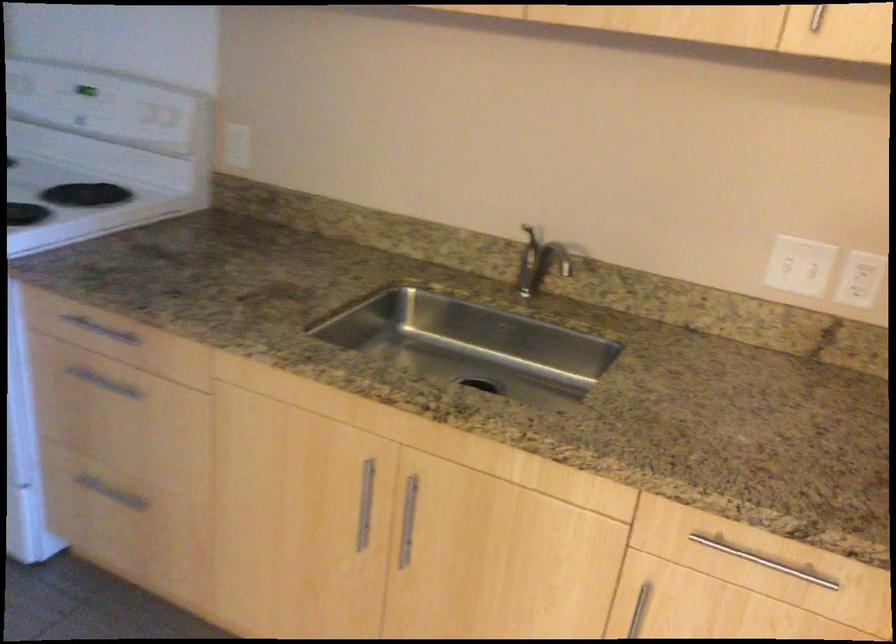
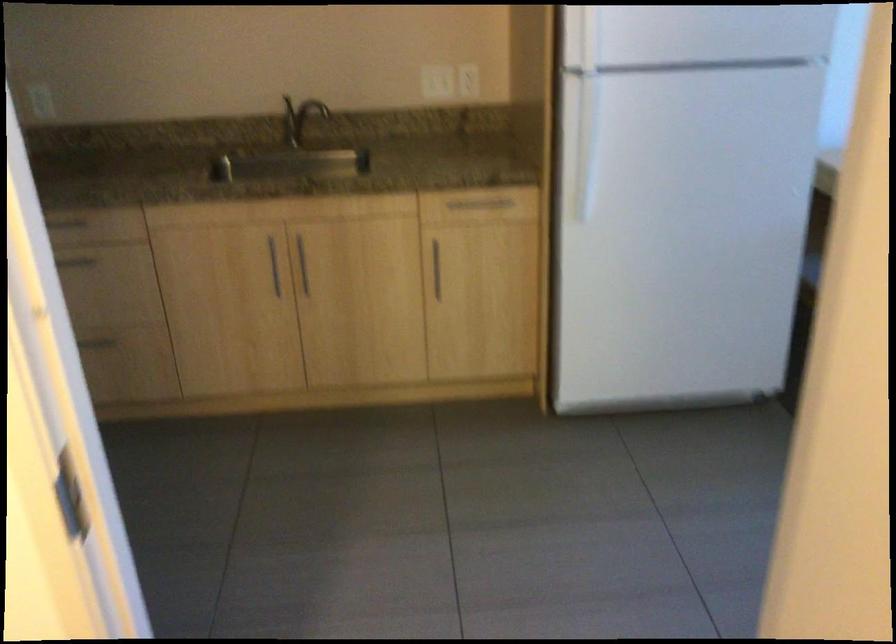
In the second image, find the point that corresponds to (547,257) in the first image.

(299, 118)